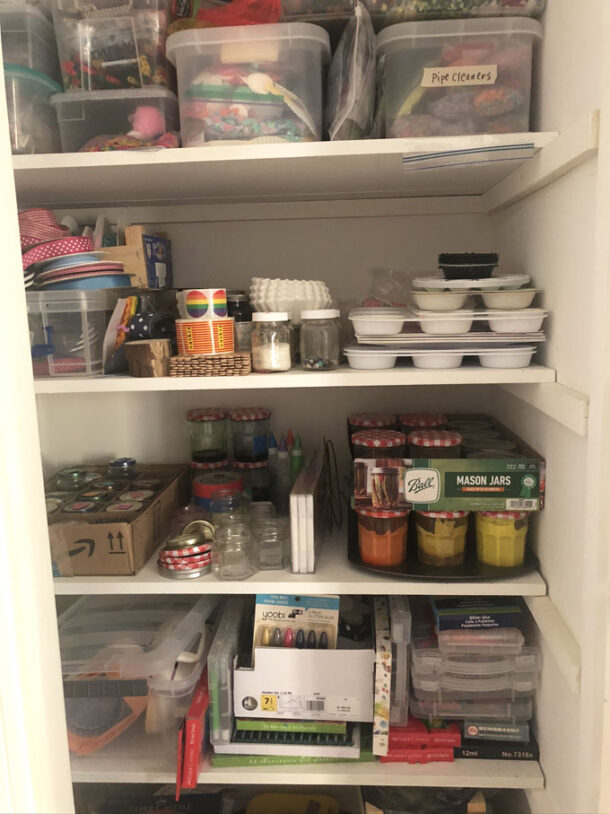
The width and height of the screenshot is (610, 814). In order to click on right wall in this screenshot , I will do `click(568, 493)`.